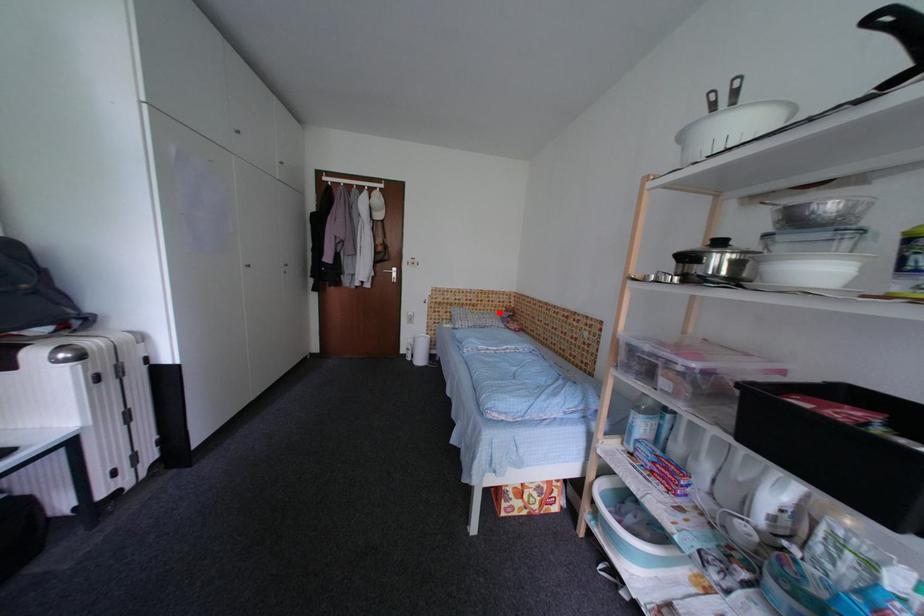
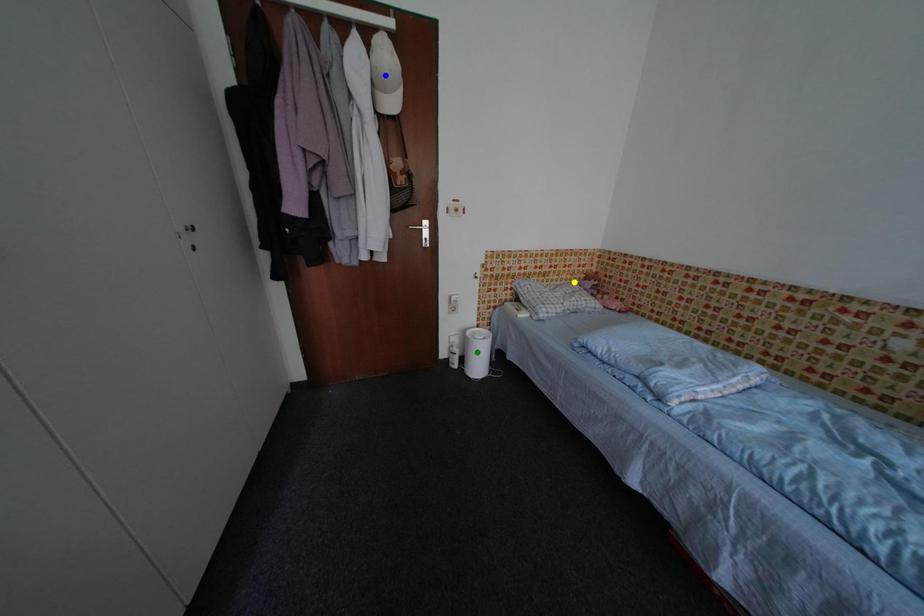
Question: I am providing you with two images of the same scene from different viewpoints. A red point is marked on the first image. You are given multiple points on the second image. Which mark in image 2 goes with the point in image 1?

Choices:
 (A) yellow point
 (B) green point
 (C) blue point

Answer: (A)